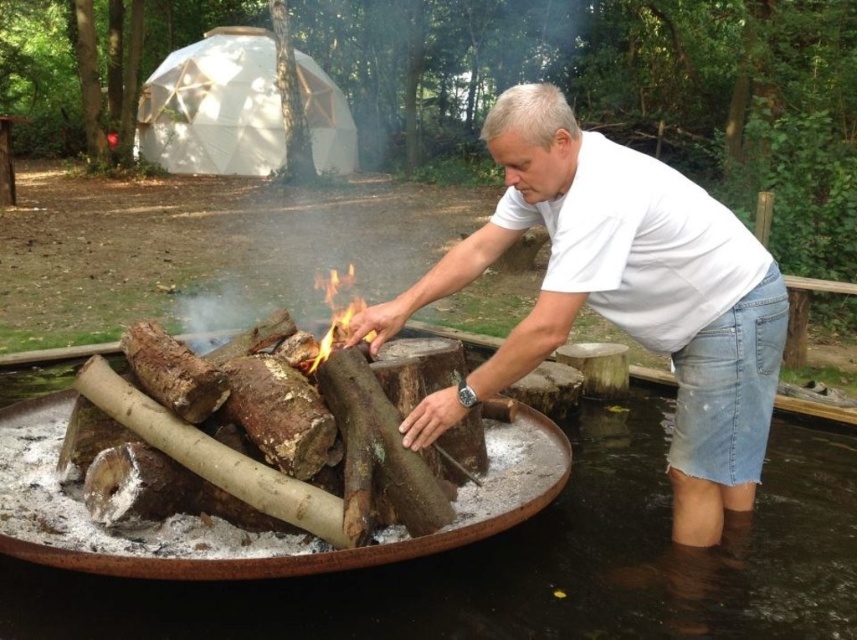
Can you confirm if white cotton shirt at center is wider than charred wood fire at center?

Correct, the width of white cotton shirt at center exceeds that of charred wood fire at center.

In the scene shown: Does white cotton shirt at center have a greater height compared to charred wood fire at center?

Correct, white cotton shirt at center is much taller as charred wood fire at center.

At what (x,y) coordinates should I click in order to perform the action: click on white cotton shirt at center. Please return your answer as a coordinate pair (x, y). This screenshot has height=640, width=857. Looking at the image, I should click on (621, 296).

I want to click on white cotton shirt at center, so click(621, 296).